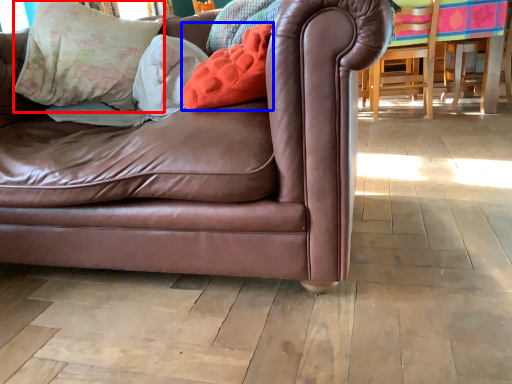
Question: Which point is further to the camera, pillow (highlighted by a red box) or pillow (highlighted by a blue box)?

Choices:
 (A) pillow
 (B) pillow

Answer: (A)